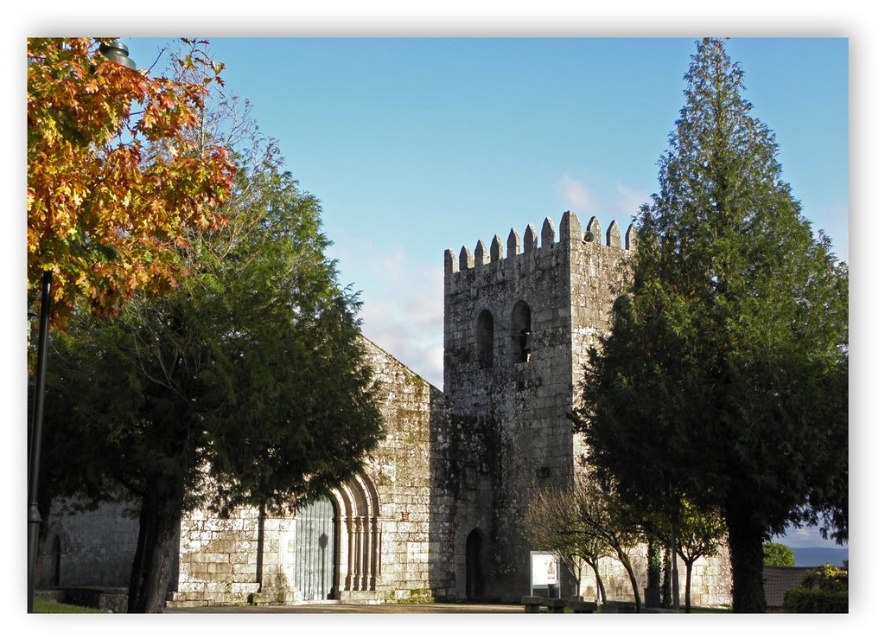
Question: Which point is farther from the camera taking this photo?

Choices:
 (A) (60, 564)
 (B) (668, 444)

Answer: (A)

Question: Is autumn leaves at left smaller than green textured tree at right?

Choices:
 (A) yes
 (B) no

Answer: (B)

Question: From the image, what is the correct spatial relationship of autumn leaves at left in relation to white stone tower at center?

Choices:
 (A) above
 (B) below

Answer: (A)

Question: Which point is closer to the camera?

Choices:
 (A) (708, 99)
 (B) (239, 454)

Answer: (B)

Question: Which point is closer to the camera?

Choices:
 (A) (841, 481)
 (B) (395, 481)

Answer: (A)

Question: Does autumn leaves at left appear on the right side of green textured tree at right?

Choices:
 (A) no
 (B) yes

Answer: (A)